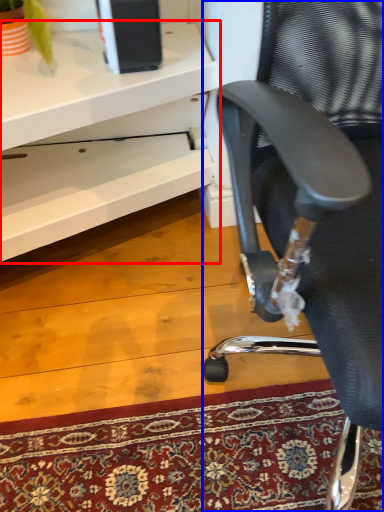
Question: Among these objects, which one is nearest to the camera, desk (highlighted by a red box) or chair (highlighted by a blue box)?

Choices:
 (A) desk
 (B) chair

Answer: (B)